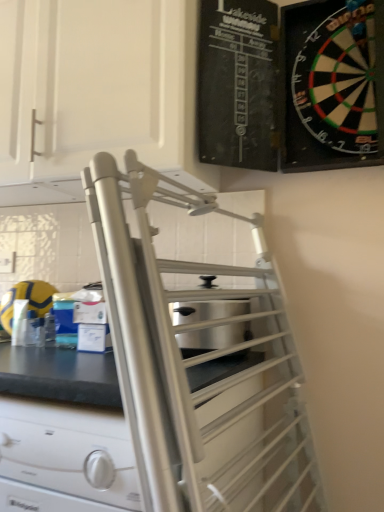
Question: Does white matte cabinet at upper left, placed as the first cabinetry when sorted from left to right, have a smaller size compared to black plastic dartboard at upper right, the first cabinetry positioned from the right?

Choices:
 (A) yes
 (B) no

Answer: (B)

Question: From a real-world perspective, is white matte cabinet at upper left, placed as the first cabinetry when sorted from left to right, located higher than black plastic dartboard at upper right, the second cabinetry viewed from the left?

Choices:
 (A) no
 (B) yes

Answer: (B)

Question: Is white matte cabinet at upper left, placed as the first cabinetry when sorted from left to right, to the right of black plastic dartboard at upper right, the first cabinetry positioned from the right, from the viewer's perspective?

Choices:
 (A) no
 (B) yes

Answer: (A)

Question: Is there a large distance between white matte cabinet at upper left, which is the 2th cabinetry from right to left, and black plastic dartboard at upper right, the first cabinetry positioned from the right?

Choices:
 (A) yes
 (B) no

Answer: (B)

Question: From the image's perspective, is white matte cabinet at upper left, which is the 2th cabinetry from right to left, under black plastic dartboard at upper right, the first cabinetry positioned from the right?

Choices:
 (A) no
 (B) yes

Answer: (A)

Question: Is the position of white matte cabinet at upper left, placed as the first cabinetry when sorted from left to right, less distant than that of black plastic dartboard at upper right, the first cabinetry positioned from the right?

Choices:
 (A) yes
 (B) no

Answer: (B)

Question: Are stainless steel toaster at center and white matte cabinet at upper left, which is the 2th cabinetry from right to left, far apart?

Choices:
 (A) yes
 (B) no

Answer: (B)

Question: From a real-world perspective, is stainless steel toaster at center physically below white matte cabinet at upper left, which is the 2th cabinetry from right to left?

Choices:
 (A) yes
 (B) no

Answer: (A)

Question: Considering the relative sizes of stainless steel toaster at center and white matte cabinet at upper left, which is the 2th cabinetry from right to left, in the image provided, is stainless steel toaster at center shorter than white matte cabinet at upper left, which is the 2th cabinetry from right to left,?

Choices:
 (A) no
 (B) yes

Answer: (B)

Question: Can you see stainless steel toaster at center touching white matte cabinet at upper left, which is the 2th cabinetry from right to left?

Choices:
 (A) no
 (B) yes

Answer: (A)

Question: Is stainless steel toaster at center to the right of white matte cabinet at upper left, placed as the first cabinetry when sorted from left to right, from the viewer's perspective?

Choices:
 (A) yes
 (B) no

Answer: (A)

Question: From the image's perspective, would you say stainless steel toaster at center is shown under white matte cabinet at upper left, which is the 2th cabinetry from right to left?

Choices:
 (A) yes
 (B) no

Answer: (A)

Question: Considering the relative sizes of stainless steel toaster at center and satin silver drawer at center in the image provided, is stainless steel toaster at center taller than satin silver drawer at center?

Choices:
 (A) yes
 (B) no

Answer: (B)